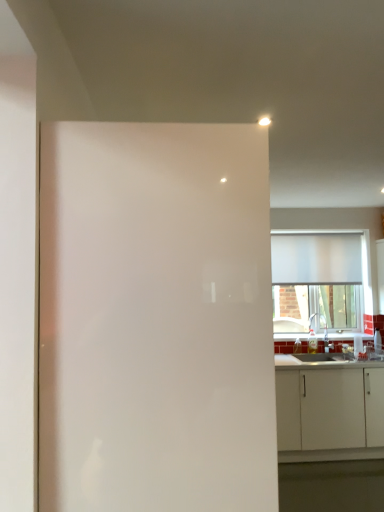
Question: Does white matte cabinet at lower right appear on the left side of white glossy screen door at center?

Choices:
 (A) yes
 (B) no

Answer: (B)

Question: Does white matte cabinet at lower right have a greater height compared to white glossy screen door at center?

Choices:
 (A) yes
 (B) no

Answer: (B)

Question: Is white matte cabinet at lower right with white glossy screen door at center?

Choices:
 (A) no
 (B) yes

Answer: (A)

Question: From a real-world perspective, is white matte cabinet at lower right beneath white glossy screen door at center?

Choices:
 (A) yes
 (B) no

Answer: (A)

Question: Considering the relative positions of white matte cabinet at lower right and white glossy screen door at center in the image provided, is white matte cabinet at lower right in front of white glossy screen door at center?

Choices:
 (A) no
 (B) yes

Answer: (A)

Question: Is point (299, 354) closer or farther from the camera than point (276, 318)?

Choices:
 (A) farther
 (B) closer

Answer: (B)

Question: Considering their positions, is white glossy countertop at lower right located in front of or behind white matte window at upper right?

Choices:
 (A) front
 (B) behind

Answer: (A)

Question: Looking at the image, does white glossy countertop at lower right seem bigger or smaller compared to white matte window at upper right?

Choices:
 (A) big
 (B) small

Answer: (A)

Question: Considering the positions of white glossy countertop at lower right and white matte window at upper right in the image, is white glossy countertop at lower right wider or thinner than white matte window at upper right?

Choices:
 (A) wide
 (B) thin

Answer: (A)

Question: Is white matte cabinet at lower right inside or outside of white matte window at upper right?

Choices:
 (A) outside
 (B) inside

Answer: (A)

Question: From a real-world perspective, is white matte cabinet at lower right positioned above or below white matte window at upper right?

Choices:
 (A) above
 (B) below

Answer: (B)

Question: Visually, is white matte cabinet at lower right positioned to the left or to the right of white matte window at upper right?

Choices:
 (A) left
 (B) right

Answer: (B)

Question: From the image's perspective, is white matte cabinet at lower right above or below white matte window at upper right?

Choices:
 (A) below
 (B) above

Answer: (A)

Question: From the image's perspective, is white glossy screen door at center above or below white matte window at upper right?

Choices:
 (A) below
 (B) above

Answer: (A)

Question: In the image, is white glossy screen door at center positioned in front of or behind white matte window at upper right?

Choices:
 (A) behind
 (B) front

Answer: (B)